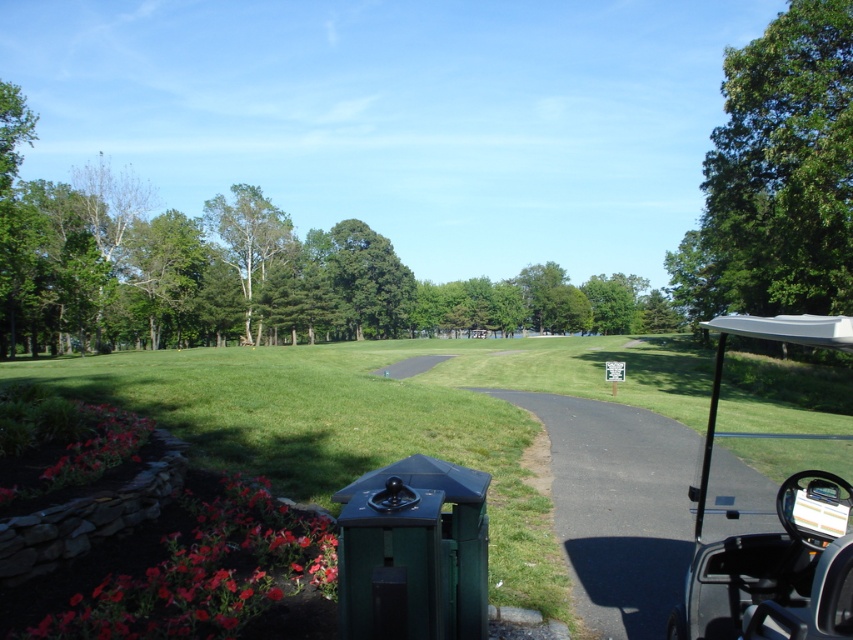
Does green matte golf course at center appear under green leafy tree at upper center?

Correct, green matte golf course at center is located below green leafy tree at upper center.

What do you see at coordinates (390, 417) in the screenshot? The width and height of the screenshot is (853, 640). I see `green matte golf course at center` at bounding box center [390, 417].

The width and height of the screenshot is (853, 640). I want to click on green matte golf course at center, so click(x=390, y=417).

Looking at this image, is green matte golf course at center to the right of silver metallic golf cart at right from the viewer's perspective?

No, green matte golf course at center is not to the right of silver metallic golf cart at right.

Does green matte golf course at center lie behind silver metallic golf cart at right?

Yes, it is behind silver metallic golf cart at right.

Is point (799, 364) positioned after point (843, 627)?

That is True.

The width and height of the screenshot is (853, 640). Identify the location of green matte golf course at center. (390, 417).

Is green leafy tree at upper right taller than green leafy tree at upper center?

In fact, green leafy tree at upper right may be shorter than green leafy tree at upper center.

Measure the distance between point (778,250) and camera.

Point (778,250) and camera are 102.49 feet apart.

Image resolution: width=853 pixels, height=640 pixels. Find the location of `green leafy tree at upper right`. green leafy tree at upper right is located at coordinates click(776, 176).